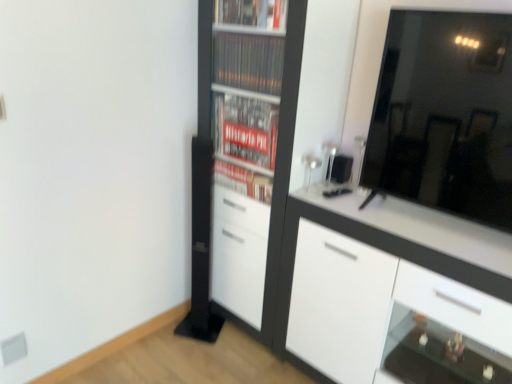
Question: From the image's perspective, does black glossy mirror at upper right appear lower than white matte cupboard at center?

Choices:
 (A) no
 (B) yes

Answer: (A)

Question: Would you consider black glossy mirror at upper right to be distant from white matte cupboard at center?

Choices:
 (A) no
 (B) yes

Answer: (A)

Question: Does black glossy mirror at upper right turn towards white matte cupboard at center?

Choices:
 (A) no
 (B) yes

Answer: (A)

Question: From a real-world perspective, is black glossy mirror at upper right under white matte cupboard at center?

Choices:
 (A) yes
 (B) no

Answer: (B)

Question: Can you confirm if black glossy mirror at upper right is wider than white matte cupboard at center?

Choices:
 (A) no
 (B) yes

Answer: (A)

Question: From the image's perspective, is black glossy mirror at upper right positioned above or below white glossy cabinet at right?

Choices:
 (A) above
 (B) below

Answer: (A)

Question: From a real-world perspective, is black glossy mirror at upper right physically located above or below white glossy cabinet at right?

Choices:
 (A) below
 (B) above

Answer: (B)

Question: Considering the positions of point (488, 117) and point (465, 294), is point (488, 117) closer or farther from the camera than point (465, 294)?

Choices:
 (A) farther
 (B) closer

Answer: (A)

Question: Is black glossy mirror at upper right wider or thinner than white glossy cabinet at right?

Choices:
 (A) wide
 (B) thin

Answer: (B)

Question: Visually, is white matte cupboard at center positioned to the left or to the right of black glossy mirror at upper right?

Choices:
 (A) left
 (B) right

Answer: (A)

Question: Is white matte cupboard at center situated inside black glossy mirror at upper right or outside?

Choices:
 (A) inside
 (B) outside

Answer: (B)

Question: Based on their sizes in the image, would you say white matte cupboard at center is bigger or smaller than black glossy mirror at upper right?

Choices:
 (A) big
 (B) small

Answer: (A)

Question: In the image, is white matte cupboard at center positioned in front of or behind black glossy mirror at upper right?

Choices:
 (A) front
 (B) behind

Answer: (B)

Question: Looking at the image, does white matte cupboard at center seem bigger or smaller compared to white glossy cabinet at right?

Choices:
 (A) big
 (B) small

Answer: (A)

Question: Is white matte cupboard at center wider or thinner than white glossy cabinet at right?

Choices:
 (A) wide
 (B) thin

Answer: (B)